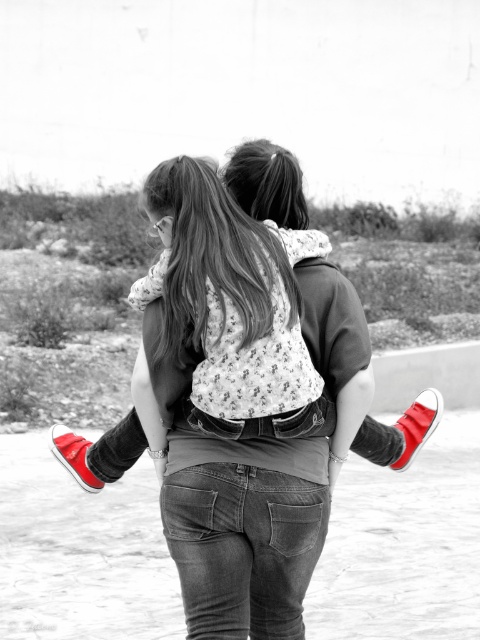
Which of these two, matte black shirt at center or floral fabric dress at center, stands shorter?

Standing shorter between the two is floral fabric dress at center.

Between point (309, 528) and point (252, 173), which one is positioned behind?

Point (252, 173)

Between point (170, 481) and point (430, 397), which one is positioned behind?

Positioned behind is point (430, 397).

At what (x,y) coordinates should I click in order to perform the action: click on matte black shirt at center. Please return your answer as a coordinate pair (x, y). Looking at the image, I should click on (227, 301).